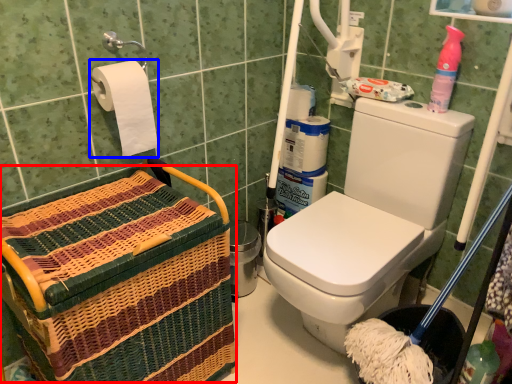
Question: Which object is closer to the camera taking this photo, basket (highlighted by a red box) or toilet paper (highlighted by a blue box)?

Choices:
 (A) basket
 (B) toilet paper

Answer: (A)